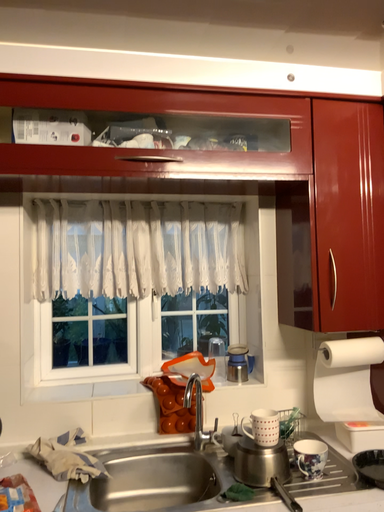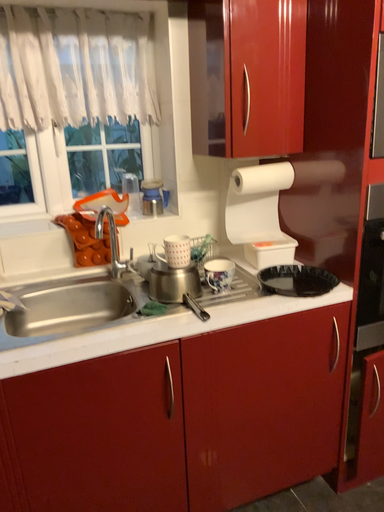
Question: How did the camera likely rotate when shooting the video?

Choices:
 (A) rotated left
 (B) rotated right

Answer: (B)